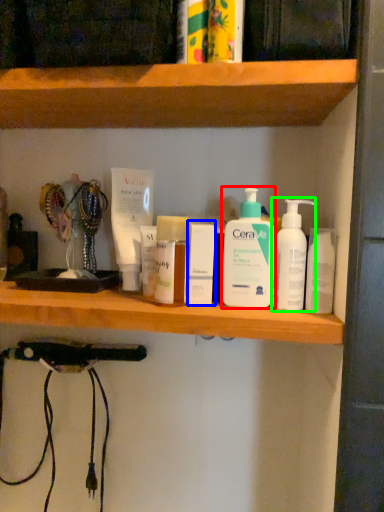
Question: Which object is positioned closest to cleaning product (highlighted by a red box)? Select from toiletry (highlighted by a blue box) and cleaning product (highlighted by a green box).

Choices:
 (A) toiletry
 (B) cleaning product

Answer: (B)